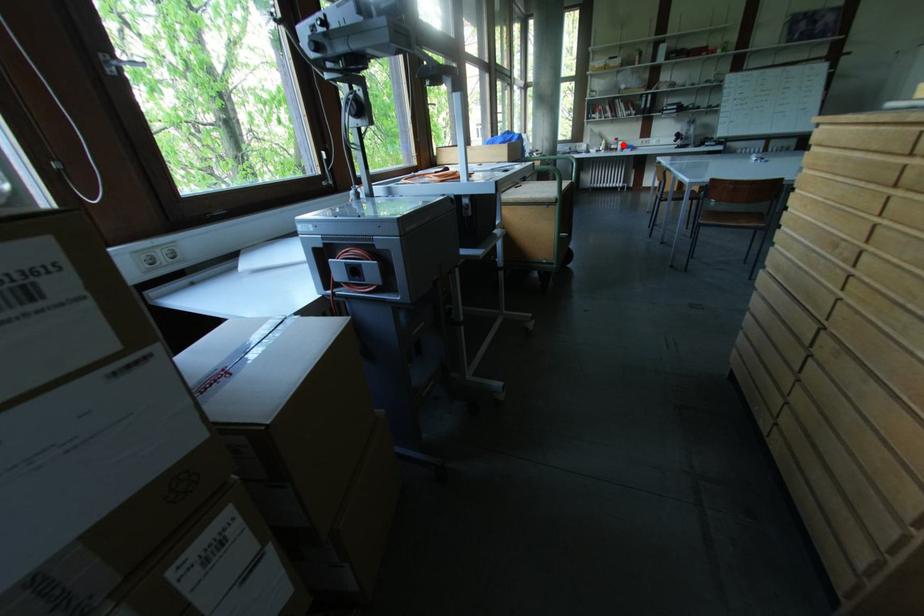
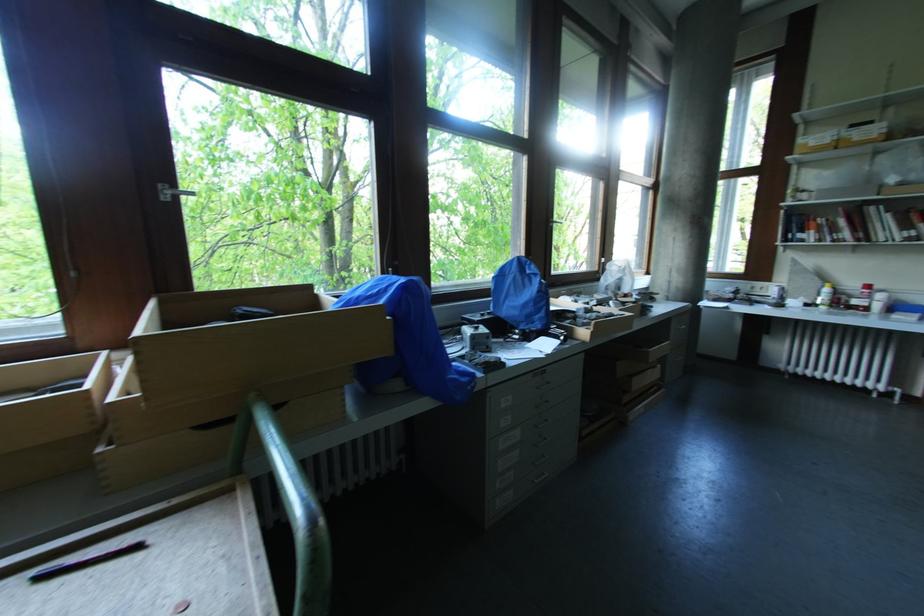
Question: I am providing you with two images of the same scene from different viewpoints. In image1, a red point is highlighted. Considering the same 3D point in image2, which of the following is correct?

Choices:
 (A) It is closer
 (B) It is farther

Answer: (B)